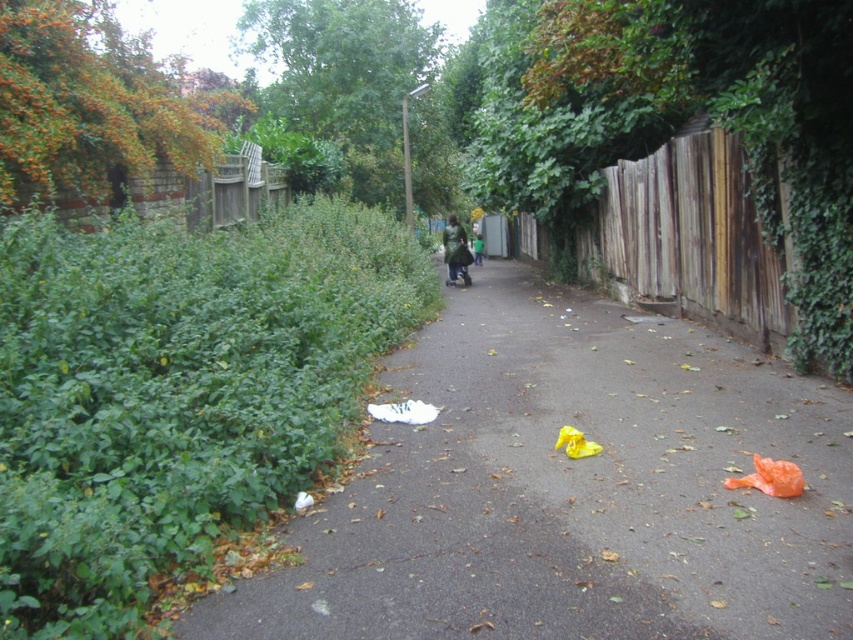
Is white paper at center taller than wooden fence at right?

No.

Does white paper at center have a larger size compared to wooden fence at right?

No, white paper at center is not bigger than wooden fence at right.

Is point (523, 356) farther from camera compared to point (715, 148)?

No.

Where is `white paper at center`? The height and width of the screenshot is (640, 853). white paper at center is located at coordinates (569, 490).

Does point (454, 253) come behind point (473, 248)?

No, it is in front of (473, 248).

Measure the distance between dark green coat at center and green matte jacket at center.

dark green coat at center and green matte jacket at center are 16.64 feet apart from each other.

Which is in front, point (456, 230) or point (479, 256)?

Point (456, 230)

This screenshot has width=853, height=640. What are the coordinates of `dark green coat at center` in the screenshot? It's located at (456, 252).

Identify the location of wooden fence at right. This screenshot has width=853, height=640. (688, 237).